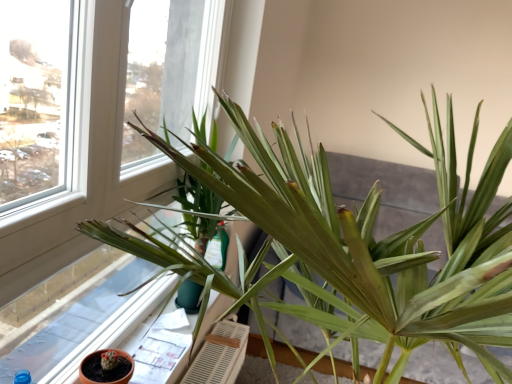
Locate an element on the screen. Image resolution: width=512 pixels, height=384 pixels. green leafy plant at center is located at coordinates (360, 245).

Describe the element at coordinates (360, 245) in the screenshot. I see `green leafy plant at center` at that location.

Image resolution: width=512 pixels, height=384 pixels. I want to click on green leafy plant at center, so click(360, 245).